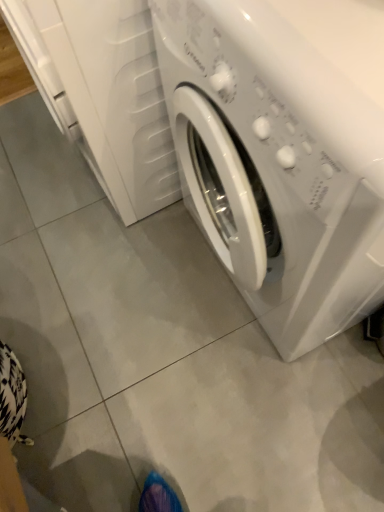
Locate an element on the screen. white glossy washing machine at center is located at coordinates (283, 152).

Describe the element at coordinates (283, 152) in the screenshot. This screenshot has width=384, height=512. I see `white glossy washing machine at center` at that location.

You are a GUI agent. You are given a task and a screenshot of the screen. Output one action in this format:
    pyautogui.click(x=<x>, y=<y>)
    Task: Click on the white glossy washing machine at center
    The image size is (384, 512).
    Given the screenshot: What is the action you would take?
    pyautogui.click(x=283, y=152)